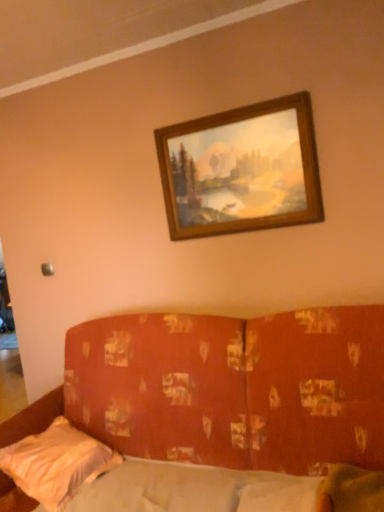
The image size is (384, 512). I want to click on free location above wooden frame at upper center (from a real-world perspective), so click(221, 110).